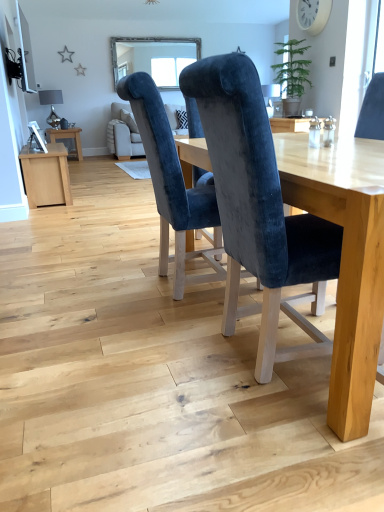
At what (x,y) coordinates should I click in order to perform the action: click on free space in front of velvet blue chair at center, the second chair in the left-to-right sequence. Please return your answer as a coordinate pair (x, y). Looking at the image, I should click on (259, 445).